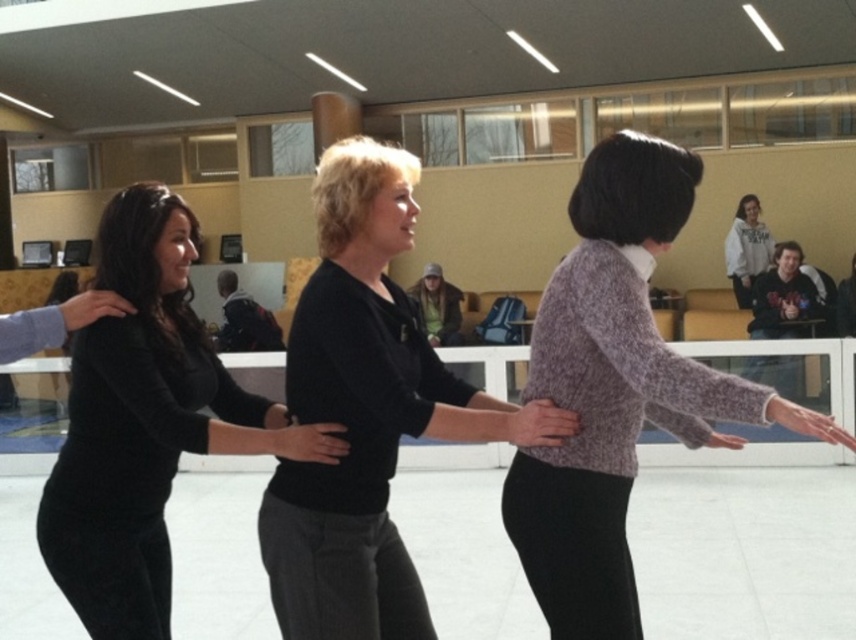
Can you confirm if black ribbed sweater at center is taller than black matte sweater at center?

Yes.

Can you confirm if black ribbed sweater at center is smaller than black matte sweater at center?

Correct, black ribbed sweater at center occupies less space than black matte sweater at center.

Is point (278, 493) closer to viewer compared to point (58, 531)?

Yes, point (278, 493) is closer to viewer.

Find the location of a particular element. This screenshot has height=640, width=856. black ribbed sweater at center is located at coordinates (366, 412).

Measure the distance between black ribbed sweater at center and knitted purple sweater at center.

17.04 inches

Which is more to the left, black ribbed sweater at center or knitted purple sweater at center?

From the viewer's perspective, black ribbed sweater at center appears more on the left side.

Which is in front, point (401, 156) or point (580, 483)?

Positioned in front is point (580, 483).

Where is `black ribbed sweater at center`? Image resolution: width=856 pixels, height=640 pixels. black ribbed sweater at center is located at coordinates (366, 412).

Between knitted purple sweater at center and black matte sweater at center, which one is positioned higher?

knitted purple sweater at center is above.

Does point (785, 412) lie behind point (81, 547)?

No, it is not.

Between point (569, 608) and point (238, 438), which one is positioned in front?

Point (569, 608) is more forward.

This screenshot has height=640, width=856. What are the coordinates of `knitted purple sweater at center` in the screenshot? It's located at (616, 388).